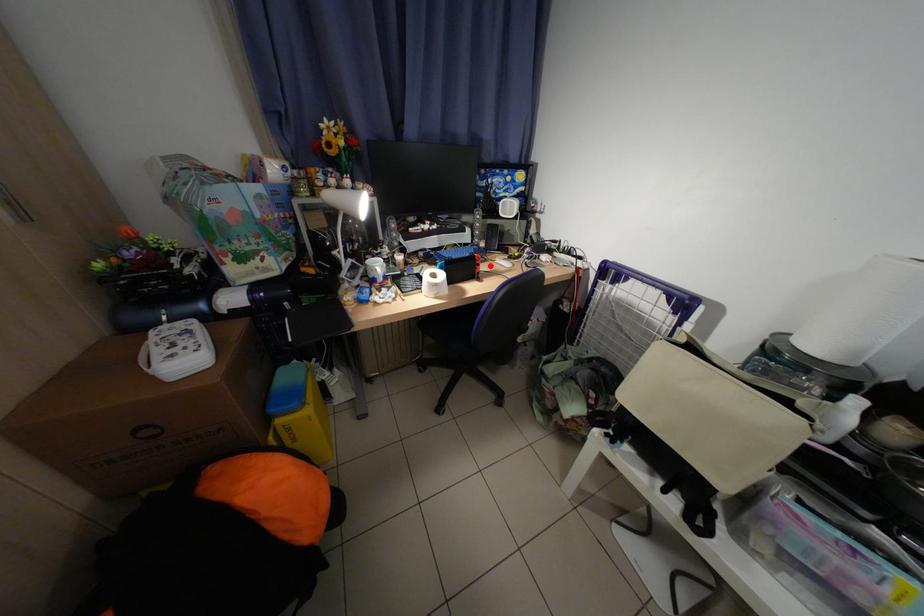
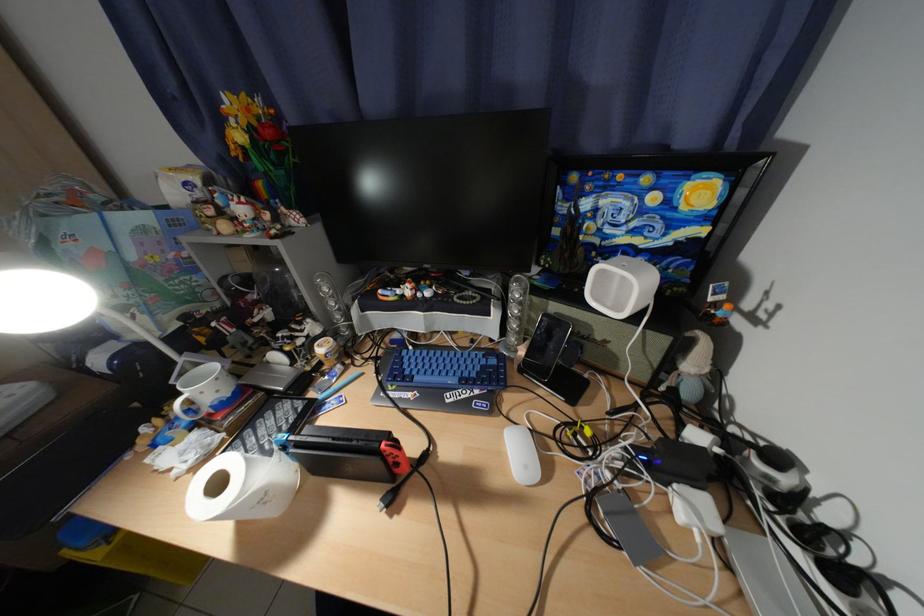
Where in the second image is the point corresponding to the highlighted location from the first image?

(408, 466)